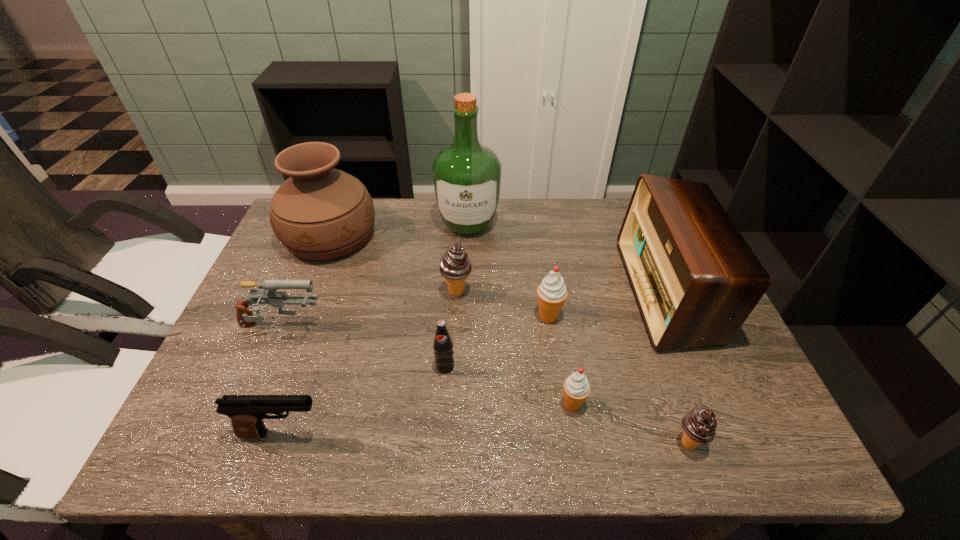
You are a GUI agent. You are given a task and a screenshot of the screen. Output one action in this format:
    pyautogui.click(x=<x>, y=<y>)
    Task: Click on the free space located on the front-facing side of the radio receiver
    The image size is (960, 540).
    Given the screenshot: What is the action you would take?
    pyautogui.click(x=579, y=292)

Where is `vacant space situated on the back of the farther red icecream`? vacant space situated on the back of the farther red icecream is located at coordinates (536, 228).

Find the location of a particular element. This screenshot has height=540, width=960. vacant point located 0.220m on the right of the farthest icecream is located at coordinates (556, 292).

What are the coordinates of `free space located 0.050m on the front label of the fourth nearest object` in the screenshot? It's located at (444, 394).

The height and width of the screenshot is (540, 960). Identify the location of vacant space located 0.400m at the barrel end of the gun. (489, 329).

Where is `free space located 0.200m at the barrel of the pistol`? This screenshot has height=540, width=960. free space located 0.200m at the barrel of the pistol is located at coordinates (426, 434).

Identify the location of free space located on the left of the third farthest icecream. (469, 404).

The image size is (960, 540). I want to click on free spot located on the left of the right chocolate icecream, so click(468, 443).

Locate an element on the screen. liquor located in the far edge section of the desktop is located at coordinates (467, 175).

Find the location of a particular element. urn located at the far edge is located at coordinates (319, 213).